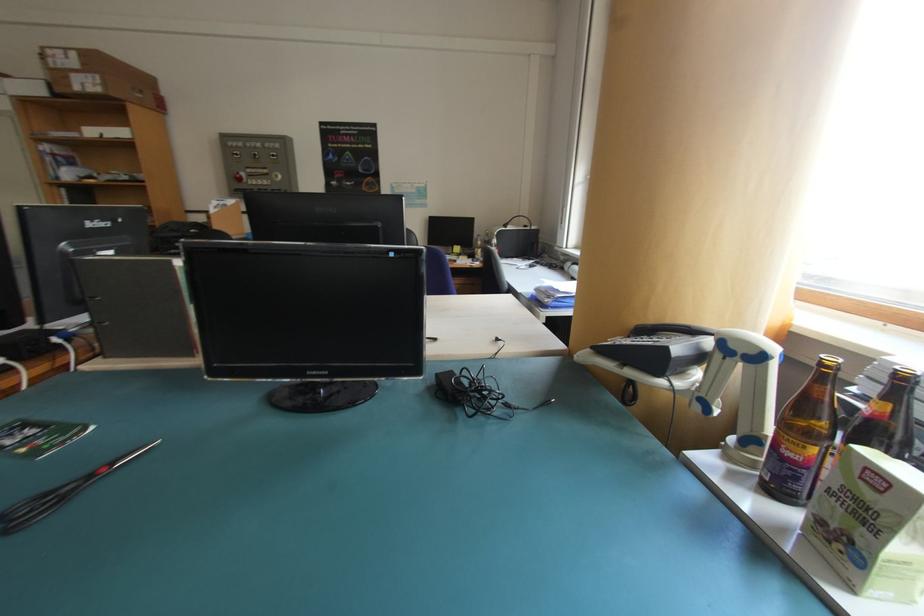
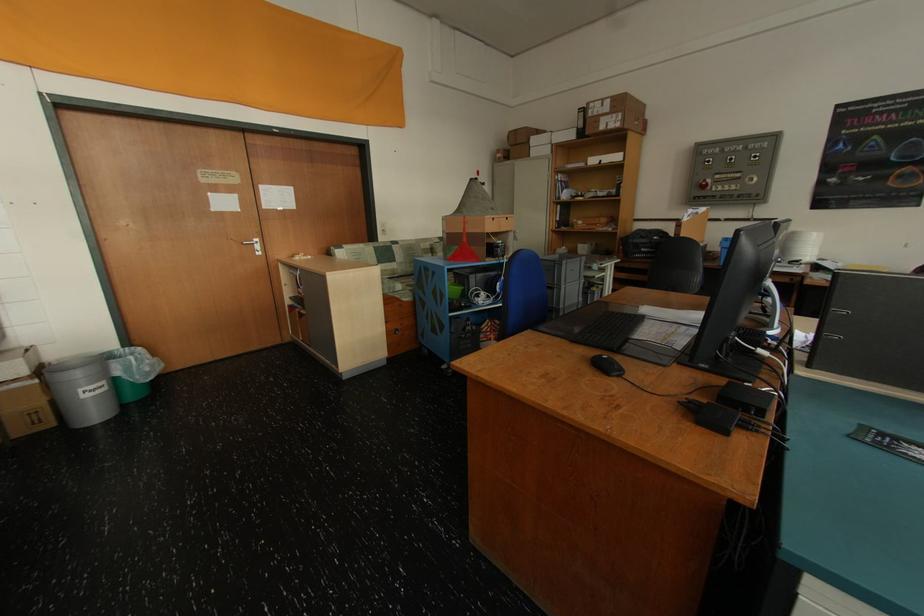
Question: I am providing you with two images of the same scene from different viewpoints. After the viewpoint changes to image2, which objects are now occluded?

Choices:
 (A) silver door handle
 (B) black binder
 (C) black keyboard
 (D) none of these

Answer: (D)